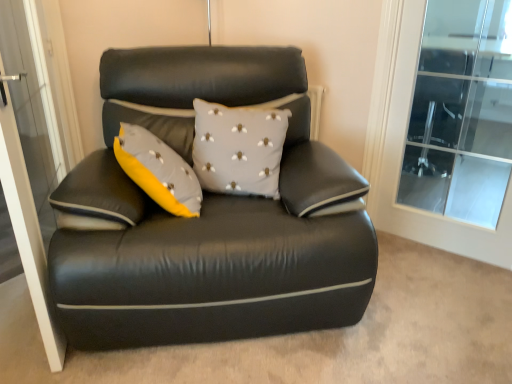
Question: Is transparent glass screen door at left taller or shorter than black leather couch at center?

Choices:
 (A) tall
 (B) short

Answer: (A)

Question: From a real-world perspective, is transparent glass screen door at left above or below black leather couch at center?

Choices:
 (A) above
 (B) below

Answer: (A)

Question: Which of these objects is positioned farthest from the black leather couch at center?

Choices:
 (A) gray fabric cushion at center
 (B) transparent glass screen door at left
 (C) transparent glass door at upper right

Answer: (C)

Question: Which is farther from the black leather couch at center?

Choices:
 (A) transparent glass screen door at left
 (B) gray fabric cushion at center
 (C) transparent glass door at upper right

Answer: (C)